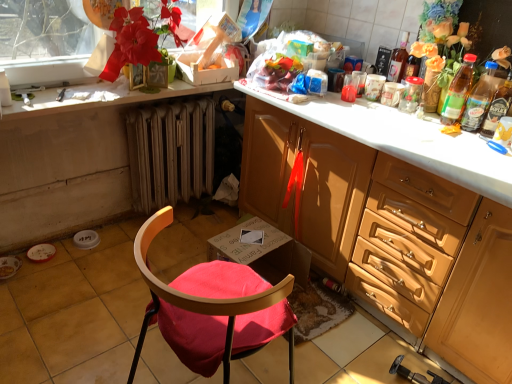
Locate an element on the screen. This screenshot has width=512, height=384. free location to the left of translucent plastic bottle at right, the 2th bottle positioned from the right is located at coordinates (423, 123).